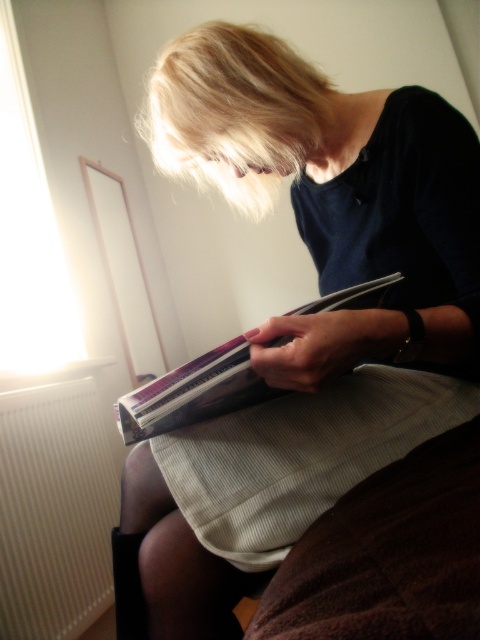
Between point (87, 541) and point (131, 435), which one is positioned behind?

Positioned behind is point (87, 541).

Between white ribbed radiator at lower left and striped fabric book at center, which one has less height?

striped fabric book at center

Does point (0, 621) come closer to viewer compared to point (225, 376)?

No, it is behind (225, 376).

What are the coordinates of `white ribbed radiator at lower left` in the screenshot? It's located at (55, 509).

Is matte black clutch at center positioned at the back of striped fabric book at center?

A: Yes, matte black clutch at center is further from the viewer.

Locate an element on the screen. The height and width of the screenshot is (640, 480). matte black clutch at center is located at coordinates (302, 317).

Is matte black clutch at center below white ribbed radiator at lower left?

No.

Looking at this image, does matte black clutch at center have a smaller size compared to white ribbed radiator at lower left?

Incorrect, matte black clutch at center is not smaller in size than white ribbed radiator at lower left.

Locate an element on the screen. The height and width of the screenshot is (640, 480). matte black clutch at center is located at coordinates (302, 317).